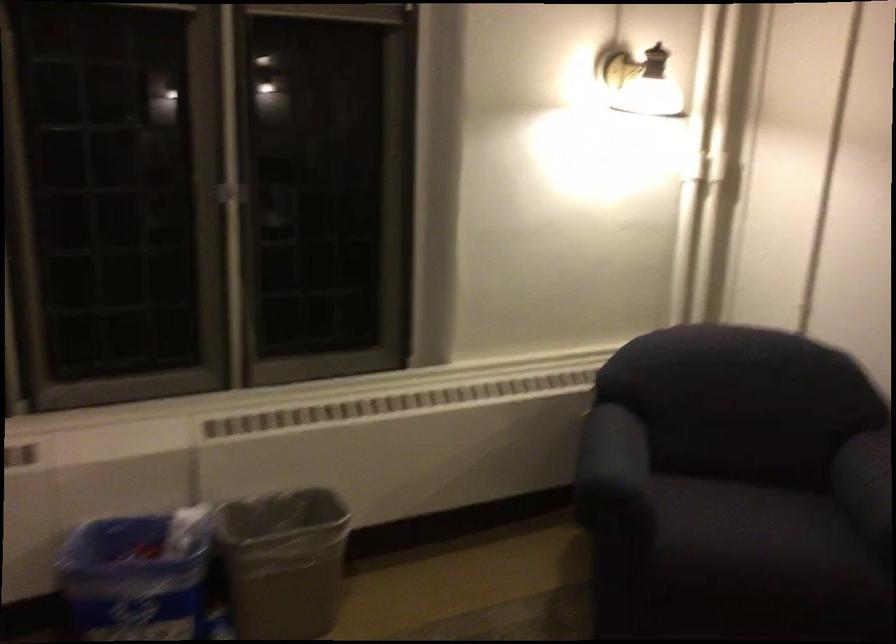
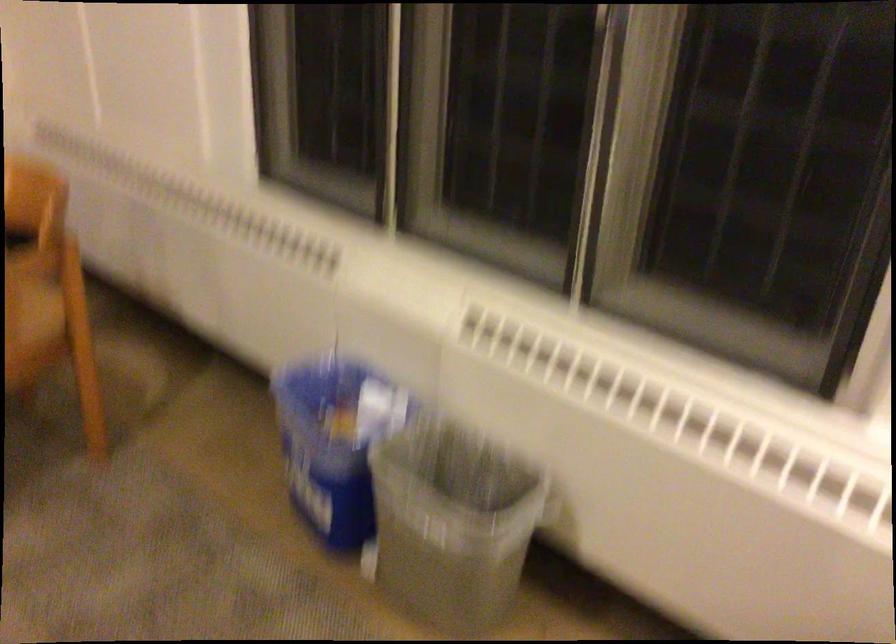
Find the pixel in the second image that matches (195,556) in the first image.

(334, 442)